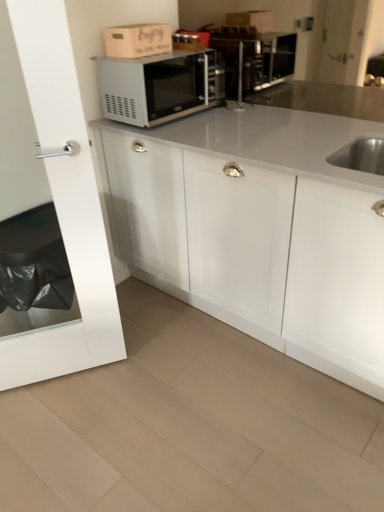
Question: In terms of size, does wooden cardboard box at upper center appear bigger or smaller than satin nickel faucet at center?

Choices:
 (A) big
 (B) small

Answer: (A)

Question: Is wooden cardboard box at upper center to the left or to the right of satin nickel faucet at center in the image?

Choices:
 (A) right
 (B) left

Answer: (B)

Question: Which is nearer to the satin nickel faucet at center?

Choices:
 (A) transparent glass door at left
 (B) wooden cardboard box at upper center
 (C) white matte cabinet at center
 (D) satin silver microwave at upper center

Answer: (D)

Question: Considering the real-world distances, which object is farthest from the satin silver microwave at upper center?

Choices:
 (A) white matte cabinet at center
 (B) transparent glass door at left
 (C) satin nickel faucet at center
 (D) wooden cardboard box at upper center

Answer: (B)